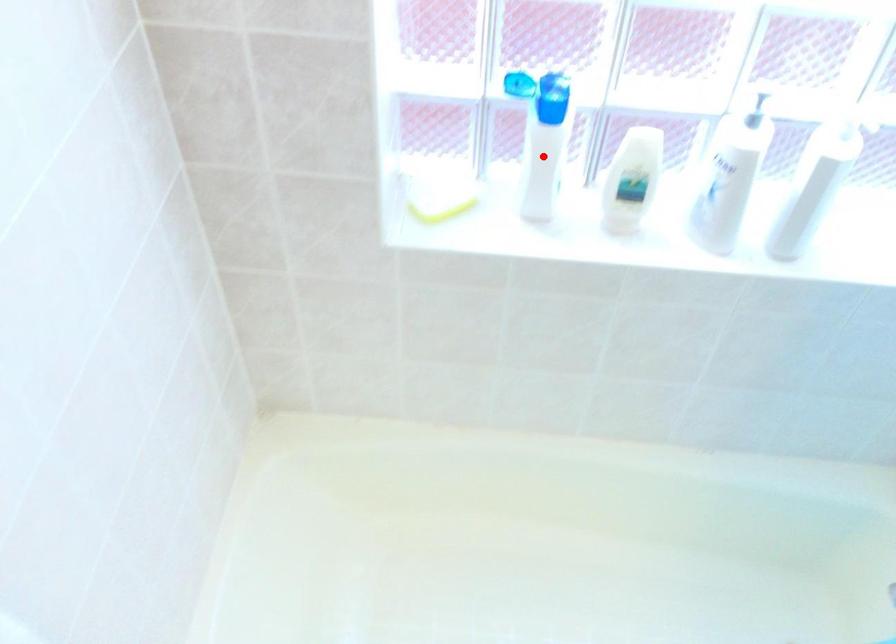
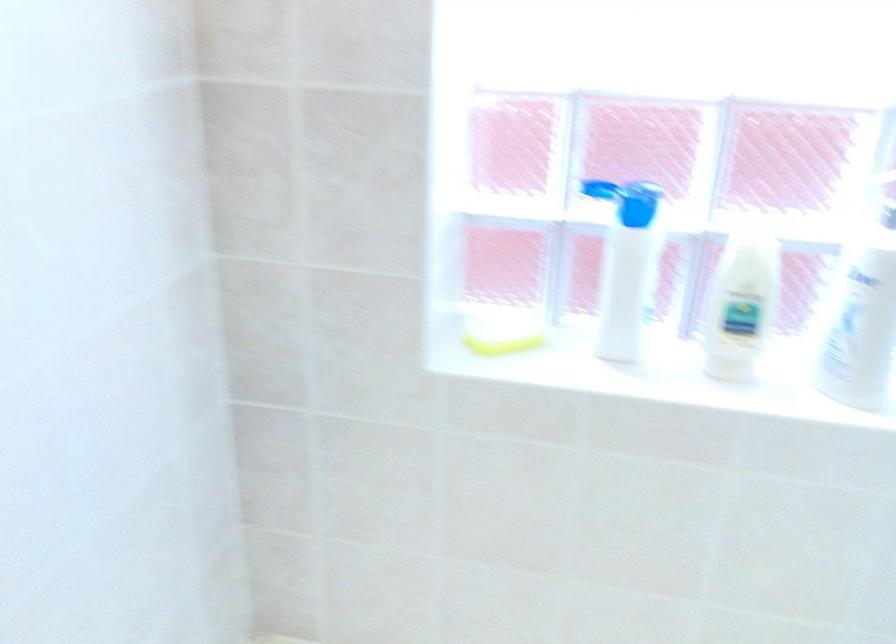
The point at the highlighted location is marked in the first image. Where is the corresponding point in the second image?

(625, 266)